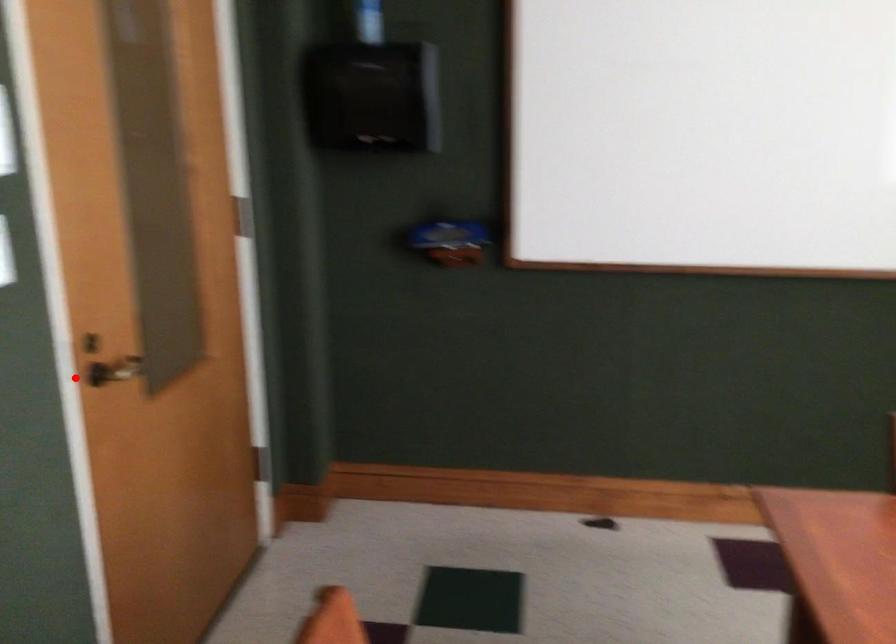
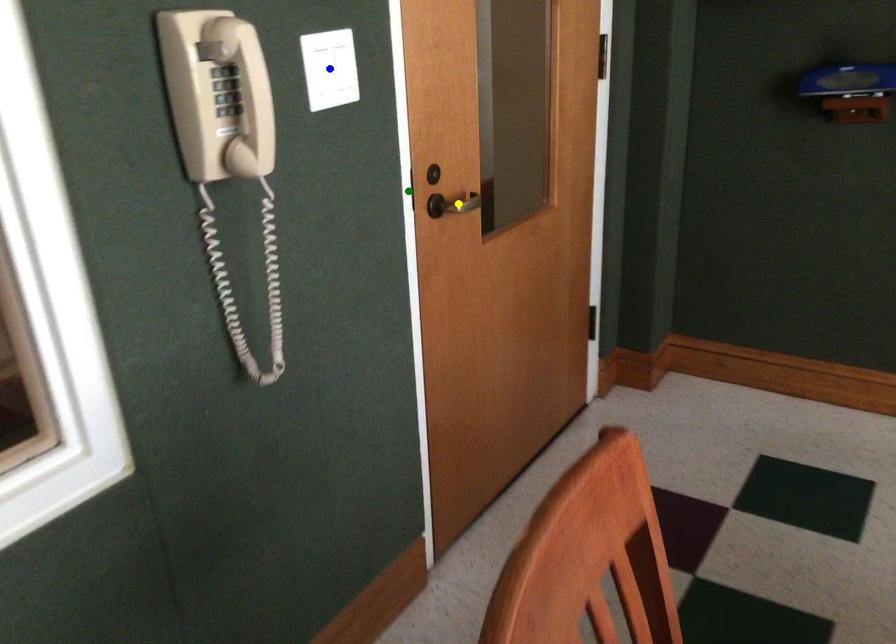
Question: I am providing you with two images of the same scene from different viewpoints. A red point is marked on the first image. You are given multiple points on the second image. Which mark in image 2 goes with the point in image 1?

Choices:
 (A) yellow point
 (B) green point
 (C) blue point

Answer: (B)